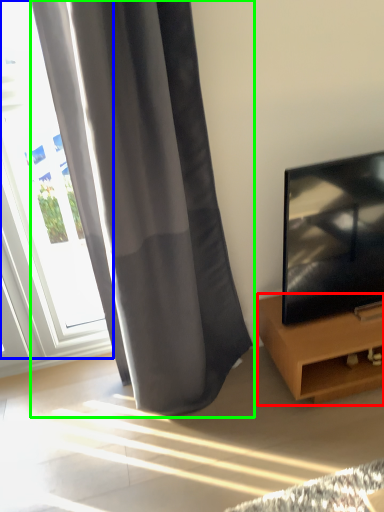
Question: Estimate the real-world distances between objects in this image. Which object is farther from furniture (highlighted by a red box), window (highlighted by a blue box) or curtain (highlighted by a green box)?

Choices:
 (A) window
 (B) curtain

Answer: (A)